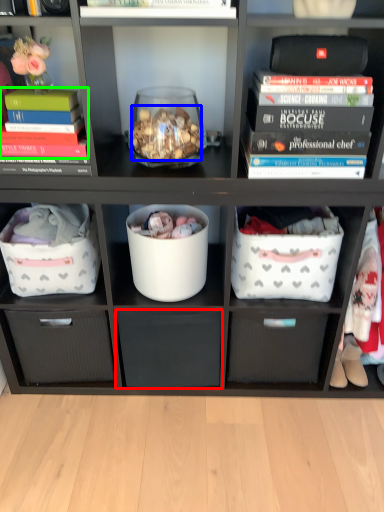
Question: Based on their relative distances, which object is nearer to drawer (highlighted by a red box)? Choose from stuff (highlighted by a blue box) and book (highlighted by a green box).

Choices:
 (A) stuff
 (B) book

Answer: (A)